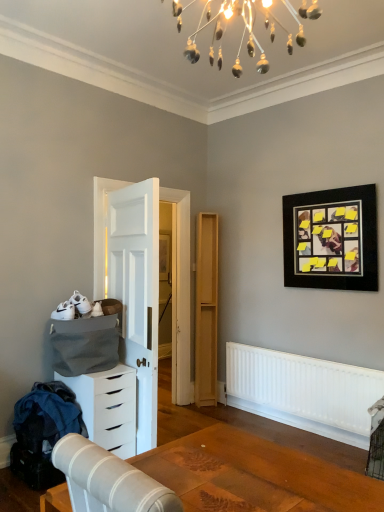
Question: From the image's perspective, is wooden table at lower center located above white matte chest of drawers at lower left?

Choices:
 (A) yes
 (B) no

Answer: (A)

Question: Is wooden table at lower center thinner than white matte chest of drawers at lower left?

Choices:
 (A) yes
 (B) no

Answer: (B)

Question: Considering the relative sizes of wooden table at lower center and white matte chest of drawers at lower left in the image provided, is wooden table at lower center smaller than white matte chest of drawers at lower left?

Choices:
 (A) no
 (B) yes

Answer: (B)

Question: Does wooden table at lower center have a greater height compared to white matte chest of drawers at lower left?

Choices:
 (A) no
 (B) yes

Answer: (A)

Question: Is white matte chest of drawers at lower left completely or partially inside wooden table at lower center?

Choices:
 (A) yes
 (B) no

Answer: (B)

Question: Looking at their shapes, would you say white matte chest of drawers at lower left is wider or thinner than light wood/file cabinet at center?

Choices:
 (A) thin
 (B) wide

Answer: (B)

Question: In terms of size, does white matte chest of drawers at lower left appear bigger or smaller than light wood/file cabinet at center?

Choices:
 (A) small
 (B) big

Answer: (B)

Question: Considering the positions of white matte chest of drawers at lower left and light wood/file cabinet at center in the image, is white matte chest of drawers at lower left taller or shorter than light wood/file cabinet at center?

Choices:
 (A) tall
 (B) short

Answer: (B)

Question: In the image, is white matte chest of drawers at lower left positioned in front of or behind light wood/file cabinet at center?

Choices:
 (A) behind
 (B) front

Answer: (B)

Question: Considering the positions of wooden table at lower center and white wooden door at center in the image, is wooden table at lower center taller or shorter than white wooden door at center?

Choices:
 (A) tall
 (B) short

Answer: (B)

Question: Based on their sizes in the image, would you say wooden table at lower center is bigger or smaller than white wooden door at center?

Choices:
 (A) big
 (B) small

Answer: (B)

Question: Visually, is wooden table at lower center positioned to the left or to the right of white wooden door at center?

Choices:
 (A) right
 (B) left

Answer: (A)

Question: In terms of width, does wooden table at lower center look wider or thinner when compared to white wooden door at center?

Choices:
 (A) thin
 (B) wide

Answer: (B)

Question: From their relative heights in the image, would you say white wooden door at center is taller or shorter than denim fabric at lower left?

Choices:
 (A) tall
 (B) short

Answer: (A)

Question: In terms of width, does white wooden door at center look wider or thinner when compared to denim fabric at lower left?

Choices:
 (A) thin
 (B) wide

Answer: (A)